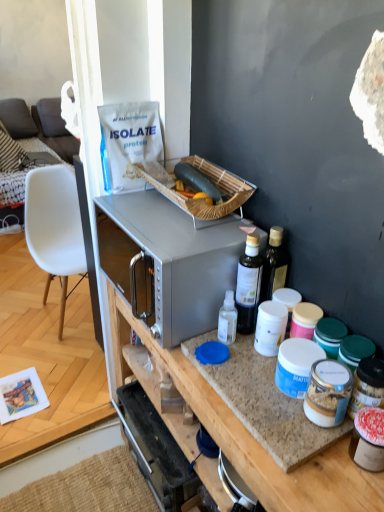
Find the location of `free space in front of white plastic chair at left`. free space in front of white plastic chair at left is located at coordinates (54, 358).